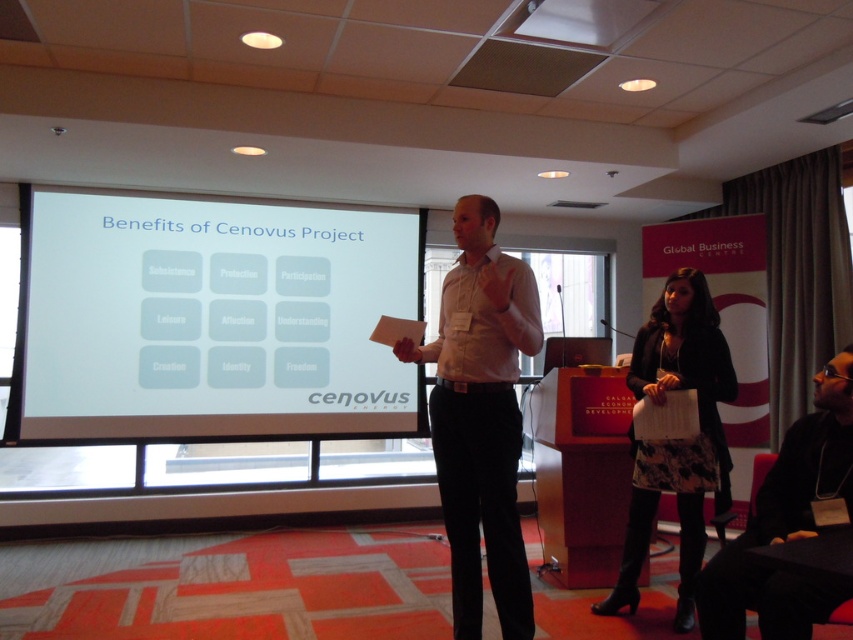
Does leopard print skirt at center have a lesser width compared to black fabric jacket at lower right?

No.

What do you see at coordinates (674, 440) in the screenshot? The height and width of the screenshot is (640, 853). I see `leopard print skirt at center` at bounding box center [674, 440].

Image resolution: width=853 pixels, height=640 pixels. I want to click on leopard print skirt at center, so click(x=674, y=440).

Is white matte projection screen at center to the left of leopard print skirt at center from the viewer's perspective?

Indeed, white matte projection screen at center is positioned on the left side of leopard print skirt at center.

Is white matte projection screen at center closer to the viewer compared to leopard print skirt at center?

No, it is not.

The image size is (853, 640). What do you see at coordinates (209, 321) in the screenshot? I see `white matte projection screen at center` at bounding box center [209, 321].

Image resolution: width=853 pixels, height=640 pixels. I want to click on white matte projection screen at center, so click(x=209, y=321).

The image size is (853, 640). Describe the element at coordinates (480, 417) in the screenshot. I see `white shirt at center` at that location.

Is white shirt at center bigger than leopard print skirt at center?

Yes, white shirt at center is bigger than leopard print skirt at center.

Who is more forward, (490, 243) or (625, 580)?

Point (490, 243) is more forward.

This screenshot has height=640, width=853. I want to click on white shirt at center, so click(x=480, y=417).